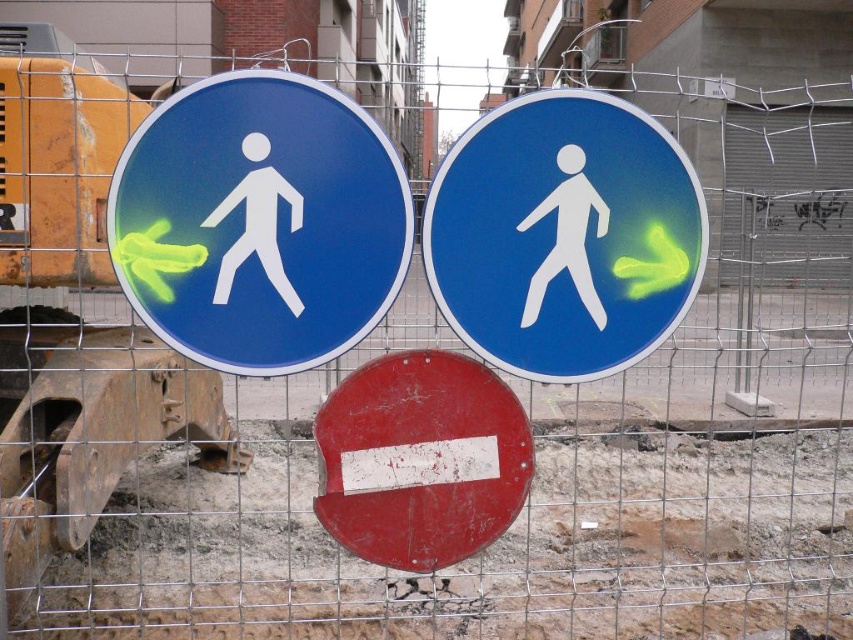
You are a delivery driver approaching a construction site and see the blue glossy pedestrian sign at upper left and the scratched red circle at center. Which of these two signs is larger in size?

The blue glossy pedestrian sign at upper left is bigger than the scratched red circle at center.

You are a pedestrian trying to cross the street and see the blue glossy pedestrian sign at center and the scratched red circle at center. Which sign should you look at first for traffic instructions?

The blue glossy pedestrian sign at center is located above the scratched red circle at center, so you should look at the blue glossy pedestrian sign at center first as it is positioned higher and likely provides primary guidance for pedestrians.

You are a delivery driver who needs to locate the blue glossy pedestrian sign at center. According to the scene description, where would you find it in the image?

The blue glossy pedestrian sign at center is located at the 2D coordinates point [564,236] in the image.